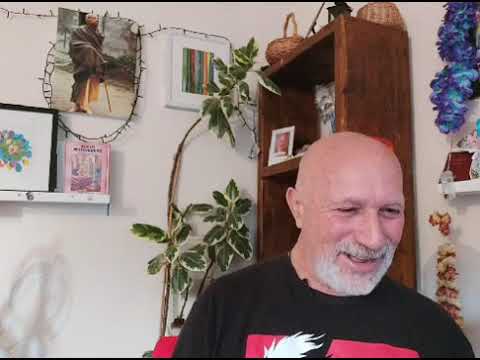
Find the location of a particular element. wall is located at coordinates (159, 151), (120, 241), (21, 81).